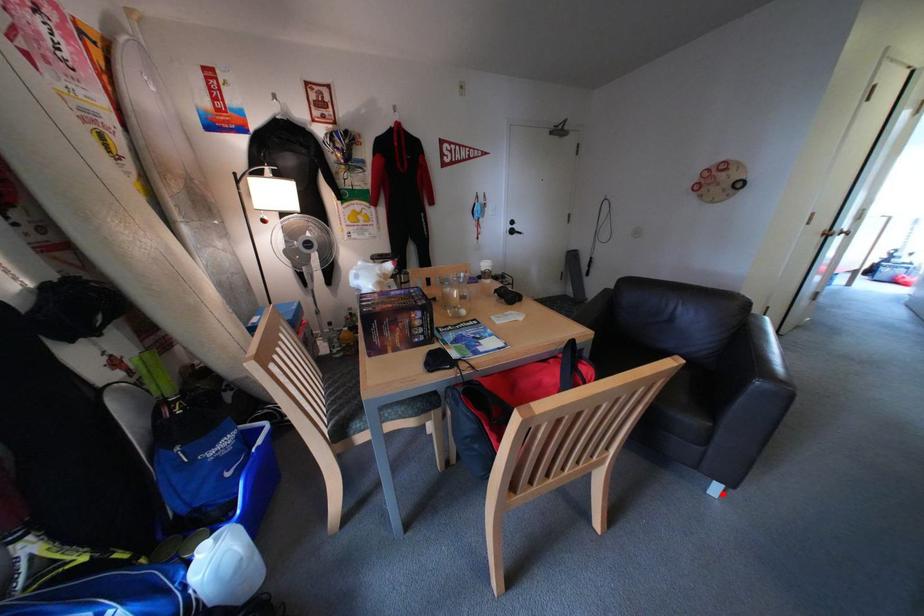
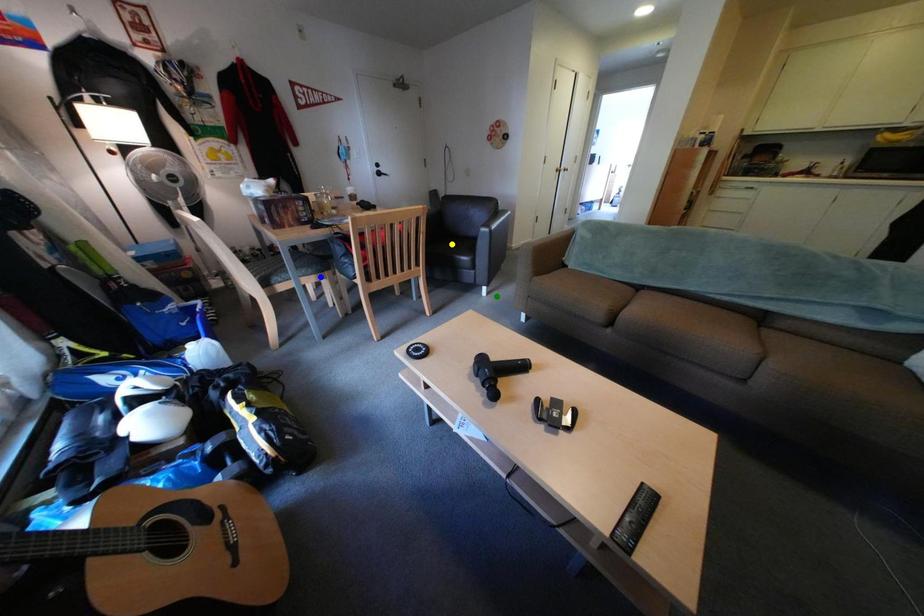
Question: I am providing you with two images of the same scene from different viewpoints. A red point is marked on the first image. You are given multiple points on the second image. Which mark in image 2 goes with the point in image 1?

Choices:
 (A) yellow point
 (B) green point
 (C) blue point

Answer: (B)